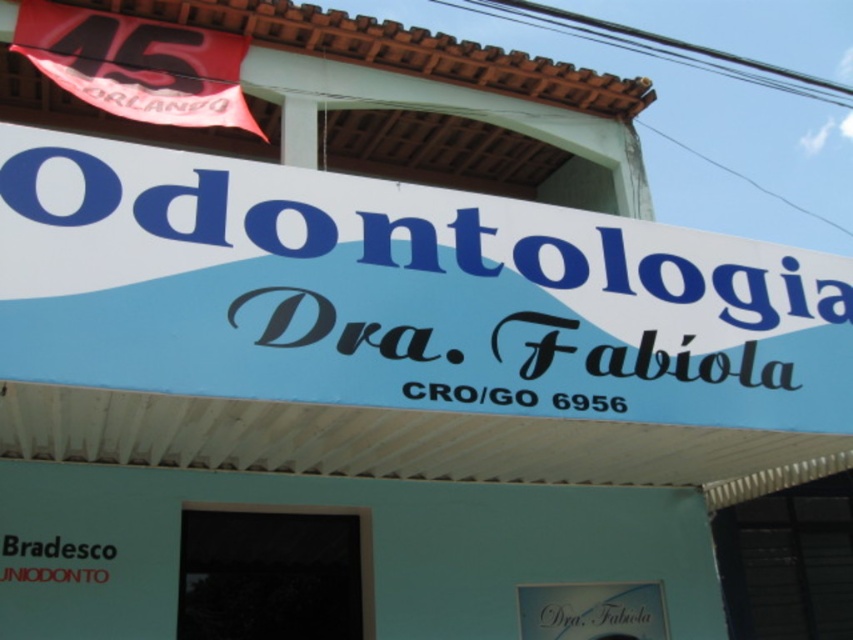
You are a patient arriving at the dental clinic and need to read the clinic name displayed on the white plastic sign at center and the white glossy signboard at center. Which one is bigger?

The white plastic sign at center is larger in size than the white glossy signboard at center, so the white plastic sign at center is bigger.

You are standing in front of the dental clinic and want to locate two specific points on the signboard. The first point is at coordinate point(711, 364) and the second is at point(573, 596). Which point is closer to you?

Point(711, 364) is in front of point(573, 596), so the first point is closer to you.